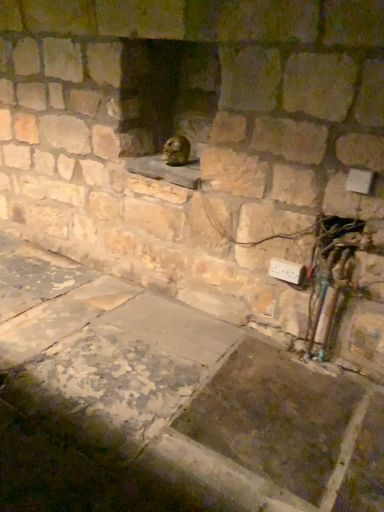
At what (x,y) coordinates should I click in order to perform the action: click on vacant area that lies in front of shiny brown rodent at center. Please return your answer as a coordinate pair (x, y). This screenshot has width=384, height=512. Looking at the image, I should click on (183, 167).